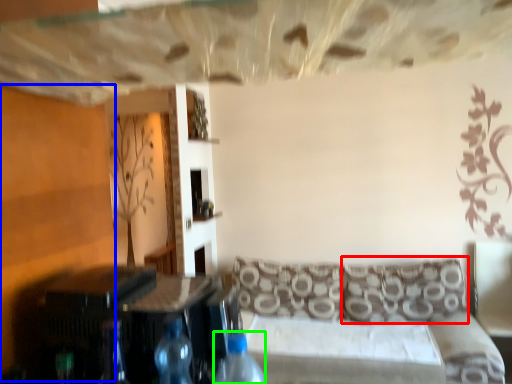
Question: Which is farther away from pillow (highlighted by a red box)? plywood (highlighted by a blue box) or bottle (highlighted by a green box)?

Choices:
 (A) plywood
 (B) bottle

Answer: (A)